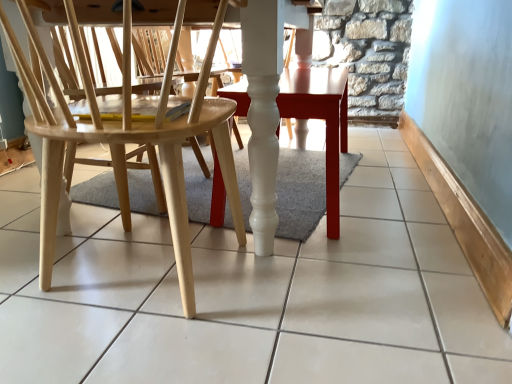
In order to face white glossy table at center, should I rotate leftwards or rightwards?

Rotate your view right by about 5.950°.

Describe the element at coordinates (322, 119) in the screenshot. Image resolution: width=512 pixels, height=384 pixels. I see `white glossy table at center` at that location.

The width and height of the screenshot is (512, 384). I want to click on white glossy table at center, so click(x=322, y=119).

Where is `natural wood chair at left`? This screenshot has height=384, width=512. natural wood chair at left is located at coordinates (121, 151).

What do you see at coordinates (121, 151) in the screenshot? I see `natural wood chair at left` at bounding box center [121, 151].

The width and height of the screenshot is (512, 384). In order to click on white glossy table at center in this screenshot , I will do point(322,119).

Which is more to the right, natural wood chair at left or white glossy table at center?

white glossy table at center is more to the right.

Considering their positions, is natural wood chair at left located in front of or behind white glossy table at center?

natural wood chair at left is positioned closer to the viewer than white glossy table at center.

Which point is more forward, (48,165) or (278,95)?

The point (48,165) is closer.

From the image's perspective, would you say natural wood chair at left is shown under white glossy table at center?

Correct, natural wood chair at left appears lower than white glossy table at center in the image.

Looking at this image, from a real-world perspective, is natural wood chair at left on top of white glossy table at center?

Correct, in the physical world, natural wood chair at left is higher than white glossy table at center.

Which object is thinner, natural wood chair at left or white glossy table at center?

white glossy table at center.

Which of these two, natural wood chair at left or white glossy table at center, stands shorter?

With less height is white glossy table at center.

Looking at the image, does natural wood chair at left seem bigger or smaller compared to white glossy table at center?

In the image, natural wood chair at left appears to be larger than white glossy table at center.

Is white glossy table at center inside natural wood chair at left?

Definitely not — white glossy table at center is not inside natural wood chair at left.

Does natural wood chair at left touch white glossy table at center?

There is a gap between natural wood chair at left and white glossy table at center.

Is natural wood chair at left positioned with its back to white glossy table at center?

Yes, natural wood chair at left is facing away from white glossy table at center.

The height and width of the screenshot is (384, 512). What are the coordinates of `table that appears on the right of natural wood chair at left` in the screenshot? It's located at (322, 119).

Between white glossy table at center and natural wood chair at left, which one appears on the left side from the viewer's perspective?

natural wood chair at left.

From the picture: Considering the relative positions of white glossy table at center and natural wood chair at left in the image provided, is white glossy table at center in front of natural wood chair at left?

No, it is behind natural wood chair at left.

Which is more distant, (x=340, y=105) or (x=193, y=136)?

The point (x=340, y=105) is farther from the camera.

From the image's perspective, is white glossy table at center beneath natural wood chair at left?

No, from the image's perspective, white glossy table at center is not below natural wood chair at left.

From a real-world perspective, does white glossy table at center stand above natural wood chair at left?

No, from a real-world perspective, white glossy table at center is not over natural wood chair at left

Can you confirm if white glossy table at center is wider than natural wood chair at left?

No, white glossy table at center is not wider than natural wood chair at left.

Based on the photo, can you confirm if white glossy table at center is taller than natural wood chair at left?

In fact, white glossy table at center may be shorter than natural wood chair at left.

Between white glossy table at center and natural wood chair at left, which one has smaller size?

With smaller size is white glossy table at center.

Is white glossy table at center not inside natural wood chair at left?

Yes.

Are white glossy table at center and natural wood chair at left making contact?

No, white glossy table at center is not with natural wood chair at left.

Could you tell me if white glossy table at center is turned towards natural wood chair at left?

No, white glossy table at center is not oriented towards natural wood chair at left.

This screenshot has height=384, width=512. Identify the location of chair on the left of the white glossy table at center. (121, 151).

This screenshot has width=512, height=384. There is a white glossy table at center. Find the location of `chair above it (from a real-world perspective)`. chair above it (from a real-world perspective) is located at coordinates (121, 151).

The image size is (512, 384). Find the location of `table below the natural wood chair at left (from a real-world perspective)`. table below the natural wood chair at left (from a real-world perspective) is located at coordinates (322, 119).